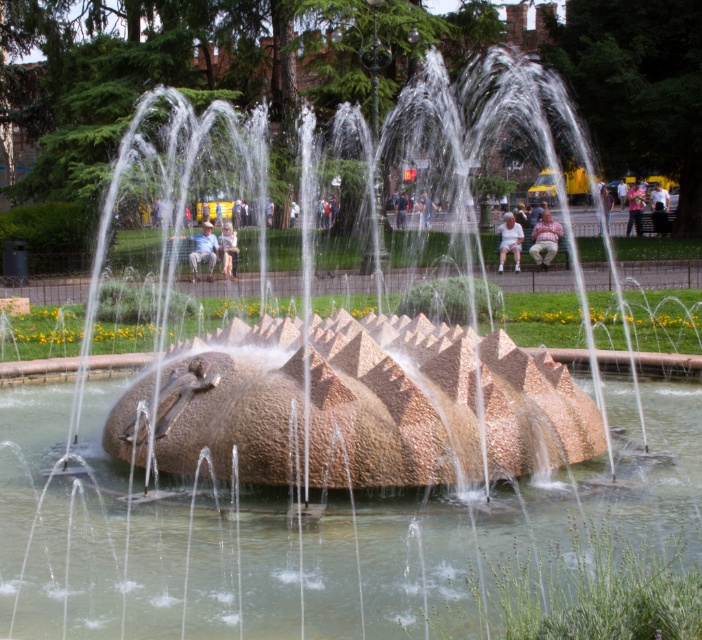
Can you confirm if translucent stone water at center is smaller than light beige fabric bench at center?

Incorrect, translucent stone water at center is not smaller in size than light beige fabric bench at center.

Between point (642, 484) and point (220, 244), which one is positioned behind?

Point (220, 244)

The height and width of the screenshot is (640, 702). Find the location of `translucent stone water at center`. translucent stone water at center is located at coordinates (307, 532).

What are the coordinates of `translucent stone water at center` in the screenshot? It's located at (307, 532).

Between white cotton shirt at center and light beige fabric bench at center, which one has more height?

white cotton shirt at center

Image resolution: width=702 pixels, height=640 pixels. What are the coordinates of `white cotton shirt at center` in the screenshot? It's located at (509, 240).

Is point (512, 234) positioned before point (225, 244)?

Yes, point (512, 234) is in front of point (225, 244).

Image resolution: width=702 pixels, height=640 pixels. Identify the location of white cotton shirt at center. (509, 240).

Can you confirm if light brown textured fabric at center is smaller than light beige fabric bench at center?

No, light brown textured fabric at center is not smaller than light beige fabric bench at center.

Does light brown textured fabric at center have a greater width compared to light beige fabric bench at center?

Correct, the width of light brown textured fabric at center exceeds that of light beige fabric bench at center.

Which is behind, point (562, 230) or point (225, 228)?

Point (562, 230)

Where is `light brown textured fabric at center`? The image size is (702, 640). light brown textured fabric at center is located at coordinates (543, 240).